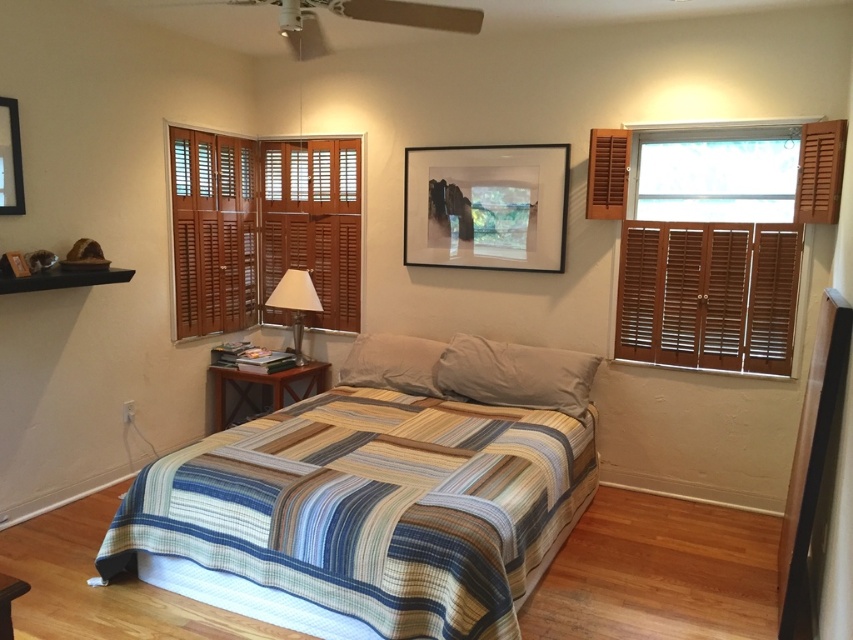
You are standing in the bedroom and want to reach a point that is 15.18 feet away from you. Can you confirm if the point you are aiming for is the point marked as point (x=277, y=193) in the image?

Yes, the point marked as point (x=277, y=193) is 15.18 feet away from the viewer, so it is the correct point you are aiming for.

You are standing in the center of the room and want to walk directly to the striped quilted bed at center. In which direction should you move?

Since the striped quilted bed at center is located at point (372, 508), you should move towards the center of the room to reach it.

You are standing at the entrance of the bedroom and want to place a small plant between the wooden shutters at center and the white matte pillow at center. Based on their positions, where should you place the plant?

The white matte pillow at center is behind the wooden shutters at center, so you should place the plant in front of the wooden shutters at center to ensure it is visible between them and the pillow.